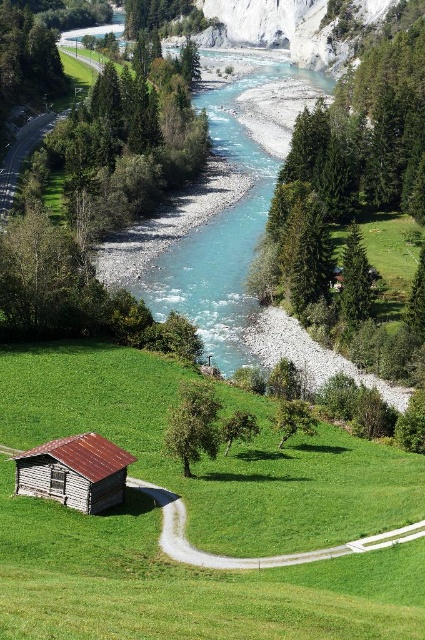
What is located at the coordinates point (223, 209) in the image?

The point (223, 209) marks the location of turquoise smooth water at center.

You are a hiker planning to cross the turquoise smooth water at center from the rustic wood cabin at lower left. Given that the distance between them is 216.16 meters, and your average walking speed is 1.5 meters per second, how many minutes will it take you to reach the water?

To cross the 216.16 meters distance between the rustic wood cabin at lower left and the turquoise smooth water at center at 1.5 meters per second, it would take approximately 216.16 divided by 1.5 equals 144.1 seconds, which is about 2.4 minutes.

You are standing at the entrance of the rustic wood cabin at lower left and want to cross the turquoise smooth water at center to reach the opposite bank. Is the water near the cabin closer to you or farther away compared to the middle section of the water?

The turquoise smooth water at center is further to the viewer than the rustic wood cabin at lower left, meaning the middle section of the water is farther away from you. Therefore, the water near the cabin is closer to you compared to the middle section.